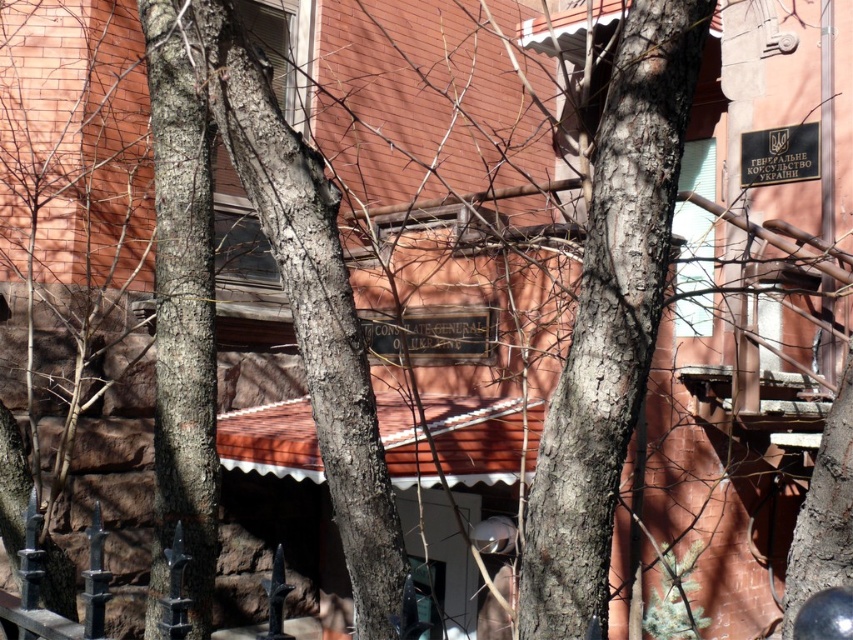
Question: Does black wood sign at center have a larger size compared to black metal sign at upper right?

Choices:
 (A) yes
 (B) no

Answer: (A)

Question: Among these points, which one is farthest from the camera?

Choices:
 (A) (479, 332)
 (B) (763, 157)

Answer: (B)

Question: Does smooth bark tree at center appear over black wood sign at center?

Choices:
 (A) no
 (B) yes

Answer: (B)

Question: Which object is the closest to the smooth bark tree at center?

Choices:
 (A) black metal sign at upper right
 (B) black wood sign at center

Answer: (B)

Question: Based on their relative distances, which object is nearer to the black wood sign at center?

Choices:
 (A) black metal sign at upper right
 (B) smooth bark tree at center

Answer: (A)

Question: From the image, what is the correct spatial relationship of smooth bark tree at center in relation to black metal sign at upper right?

Choices:
 (A) above
 (B) below

Answer: (B)